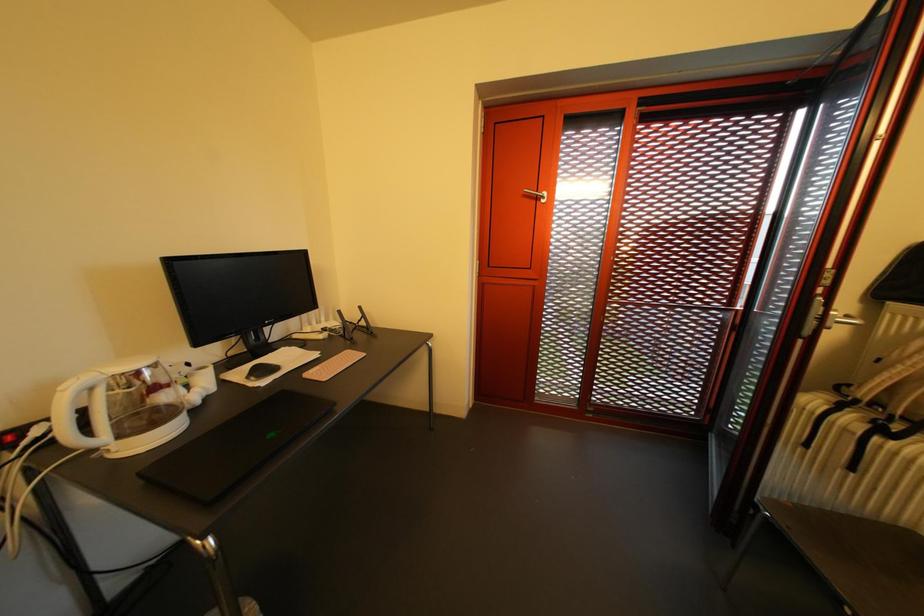
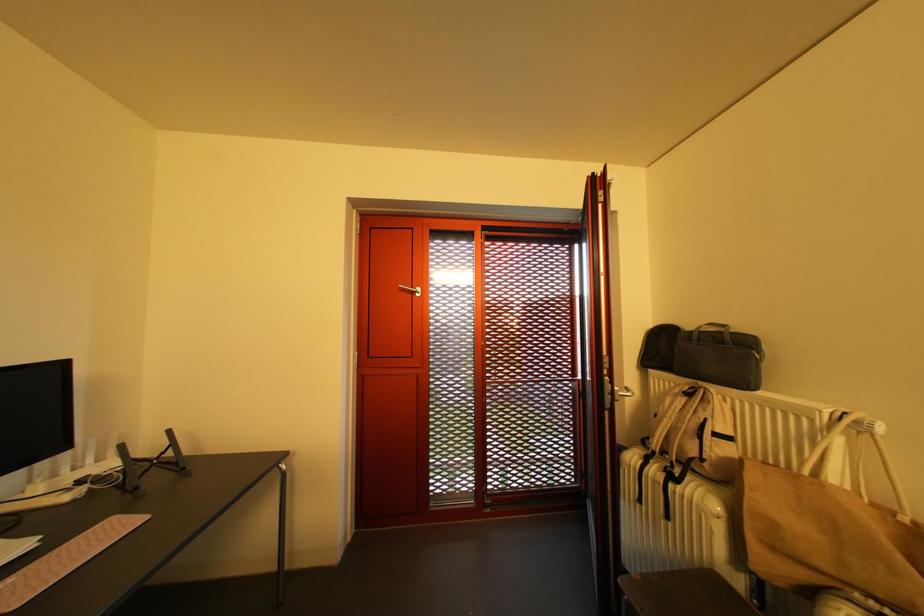
Question: What movement of the cameraman would produce the second image?

Choices:
 (A) Left
 (B) Right
 (C) Forward
 (D) Backward

Answer: (B)